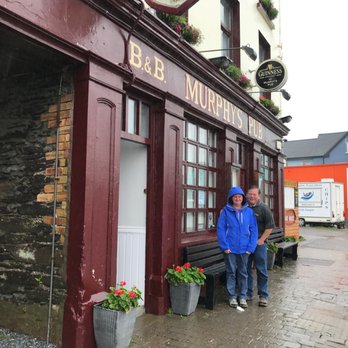
Where is `open doorway`? open doorway is located at coordinates (129, 232).